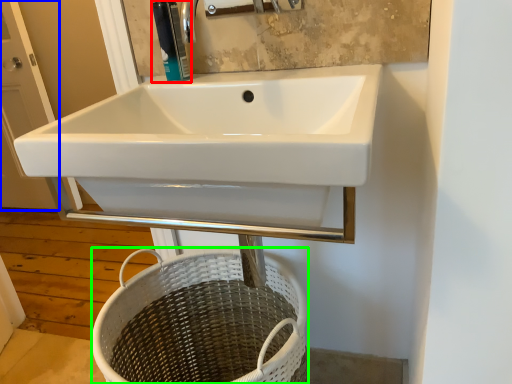
Question: Which object is the closest to the soap dispenser (highlighted by a red box)? Choose among these: screen door (highlighted by a blue box) or basket (highlighted by a green box).

Choices:
 (A) screen door
 (B) basket

Answer: (B)